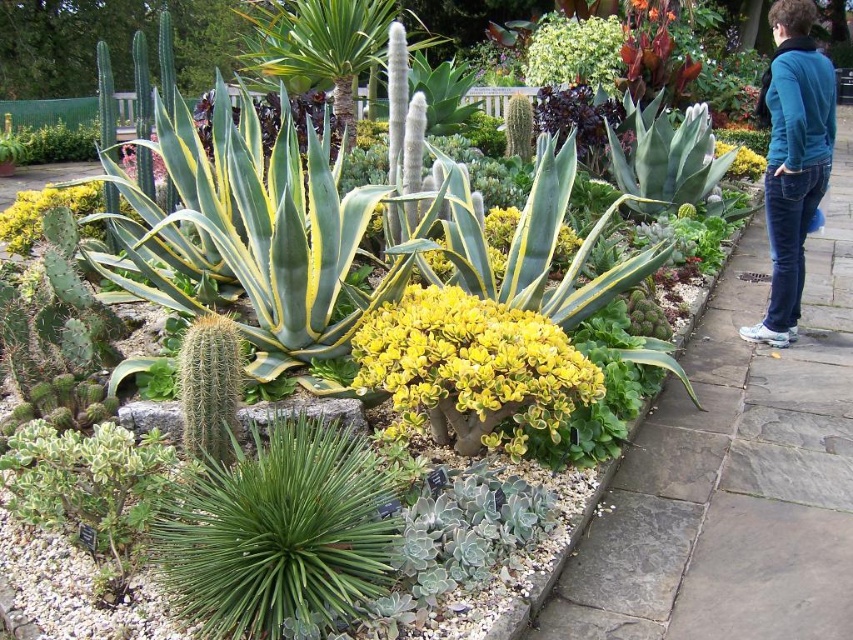
Question: Considering the relative positions of teal fleece jacket at upper right and yellow matte flower at center in the image provided, where is teal fleece jacket at upper right located with respect to yellow matte flower at center?

Choices:
 (A) left
 (B) right

Answer: (A)

Question: Does teal fleece jacket at upper right have a smaller size compared to yellow matte flower at center?

Choices:
 (A) no
 (B) yes

Answer: (A)

Question: Which object is the closest to the teal fleece jacket at upper right?

Choices:
 (A) gray stone pavement at lower right
 (B) yellow matte flower at center

Answer: (A)

Question: Which of the following is the closest to the observer?

Choices:
 (A) (753, 161)
 (B) (786, 100)
 (C) (831, 241)

Answer: (B)

Question: Observing the image, what is the correct spatial positioning of teal fleece jacket at upper right in reference to yellow matte flower at center?

Choices:
 (A) right
 (B) left

Answer: (B)

Question: Which of these objects is positioned farthest from the teal fleece jacket at upper right?

Choices:
 (A) yellow matte flower at center
 (B) gray stone pavement at lower right

Answer: (A)